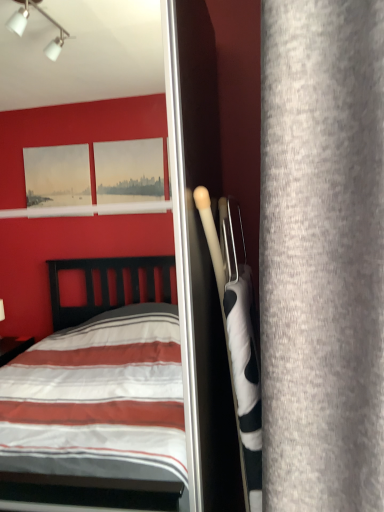
Question: Considering the positions of point (261, 141) and point (142, 248), is point (261, 141) closer or farther from the camera than point (142, 248)?

Choices:
 (A) farther
 (B) closer

Answer: (B)

Question: Do you think gray fabric curtain at right is within white glossy screen door at center, or outside of it?

Choices:
 (A) inside
 (B) outside

Answer: (B)

Question: From a real-world perspective, is gray fabric curtain at right physically located above or below white glossy screen door at center?

Choices:
 (A) above
 (B) below

Answer: (A)

Question: Is white glossy screen door at center taller or shorter than gray fabric curtain at right?

Choices:
 (A) tall
 (B) short

Answer: (A)

Question: Considering their positions, is white glossy screen door at center located in front of or behind gray fabric curtain at right?

Choices:
 (A) front
 (B) behind

Answer: (B)

Question: From a real-world perspective, is white glossy screen door at center physically located above or below gray fabric curtain at right?

Choices:
 (A) above
 (B) below

Answer: (B)

Question: Is white glossy screen door at center situated inside gray fabric curtain at right or outside?

Choices:
 (A) outside
 (B) inside

Answer: (A)